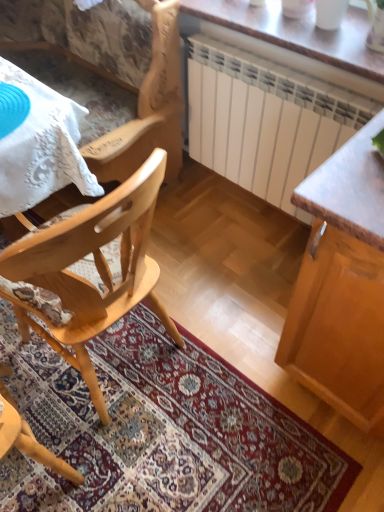
You are a GUI agent. You are given a task and a screenshot of the screen. Output one action in this format:
    pyautogui.click(x=<x>, y=<y>)
    Task: Click on the free point below natural wood chair at left, which is counted as the first chair, starting from the bottom (from a real-world perspective)
    The image size is (384, 512).
    Given the screenshot: What is the action you would take?
    pyautogui.click(x=108, y=365)